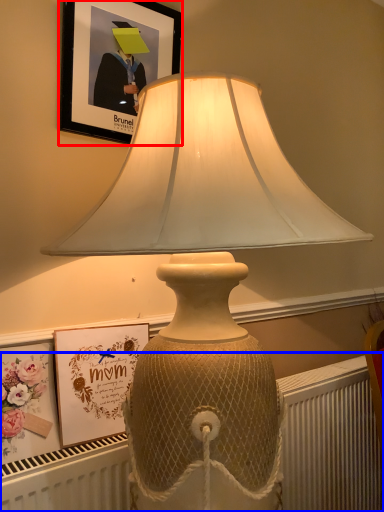
Question: Among these objects, which one is nearest to the camera, picture frame (highlighted by a red box) or radiator (highlighted by a blue box)?

Choices:
 (A) picture frame
 (B) radiator

Answer: (B)